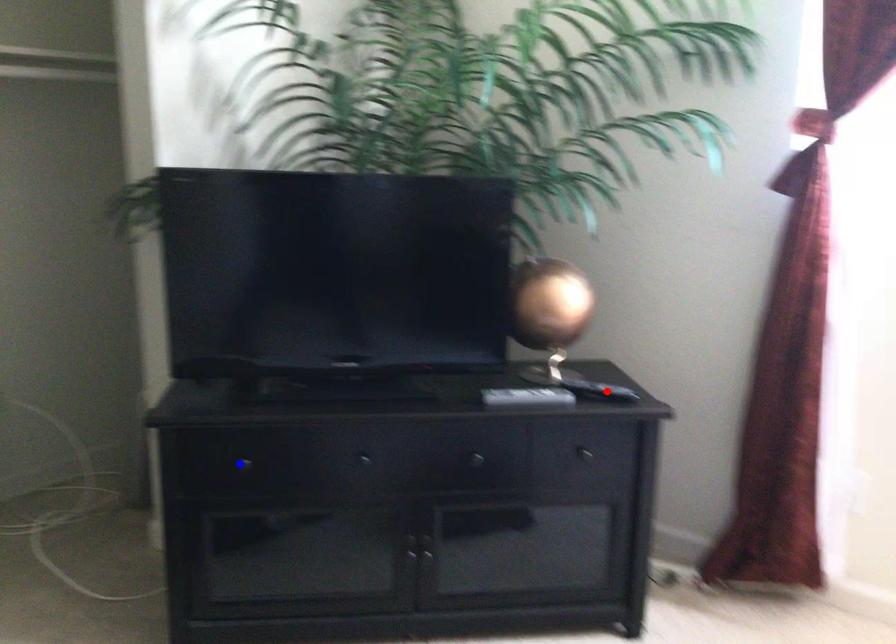
Question: Which of the two points in the image is closer to the camera?

Choices:
 (A) Blue point is closer.
 (B) Red point is closer.

Answer: (A)